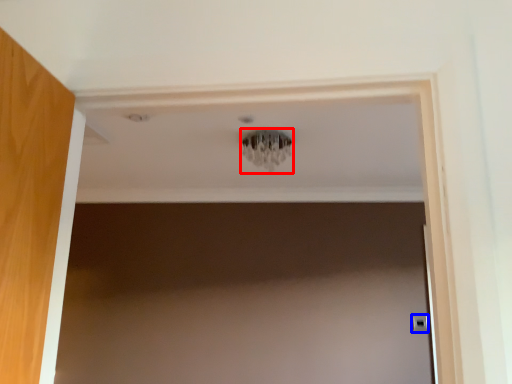
Question: Among these objects, which one is nearest to the camera, light fixture (highlighted by a red box) or door handle (highlighted by a blue box)?

Choices:
 (A) light fixture
 (B) door handle

Answer: (A)